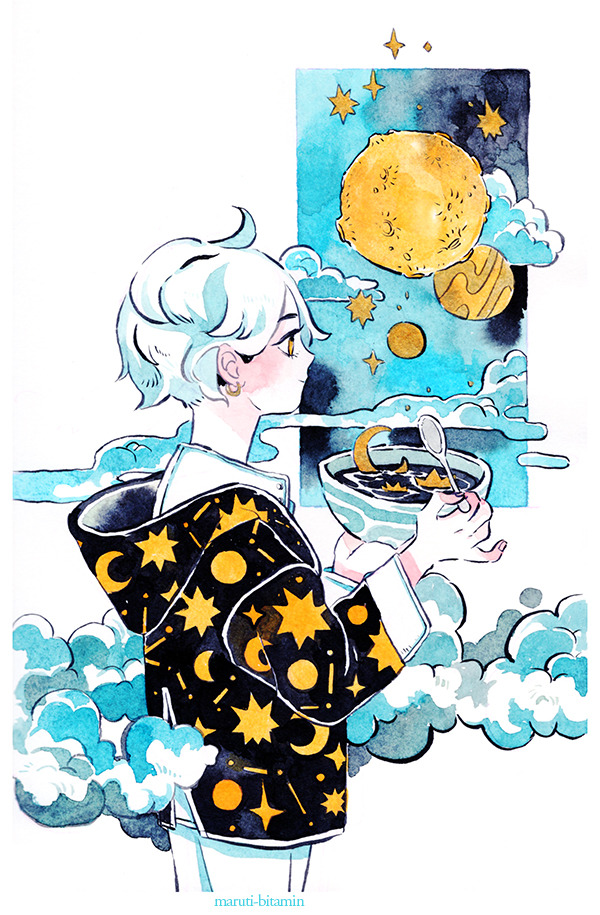
Identify the location of spoon. The width and height of the screenshot is (600, 915). (435, 434).